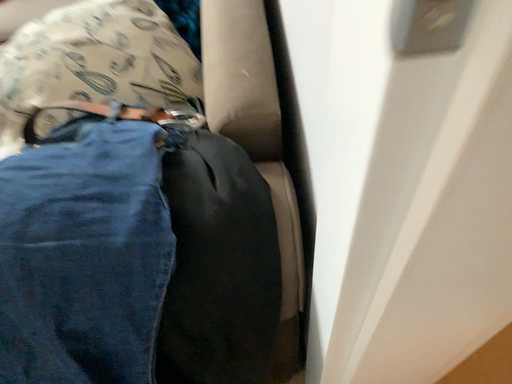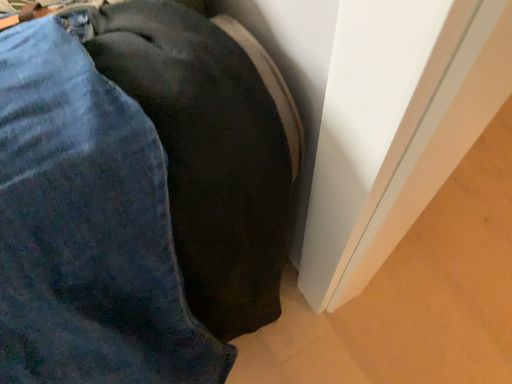
Question: Which way did the camera rotate in the video?

Choices:
 (A) rotated left
 (B) rotated right

Answer: (B)